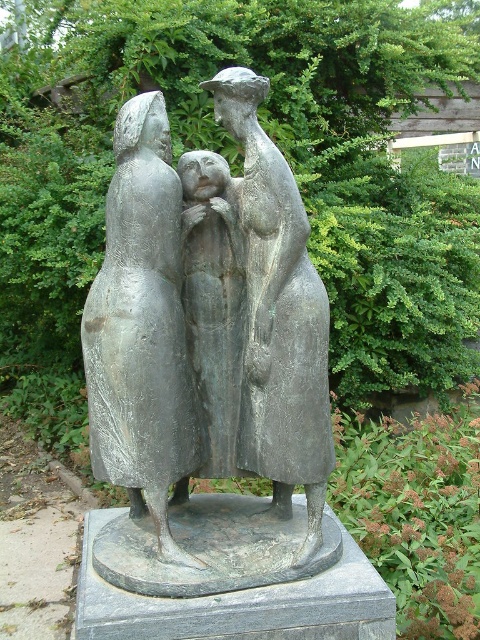
You are an art conservator assessing the space between two bronze artworks in the garden. The bronze sculpture at center and the bronze statue at center are both part of the installation. Which one has a greater width?

The bronze sculpture at center has a greater width than the bronze statue at center according to the description.

You are an art student standing in front of the sculpture. You need to sketch the matte gray statue at center. Where should you position yourself to capture the statue in your drawing?

The matte gray statue at center is located at point 2D coordinates of (142,330), so you should position yourself directly in front of the statue to capture its central position in your drawing.